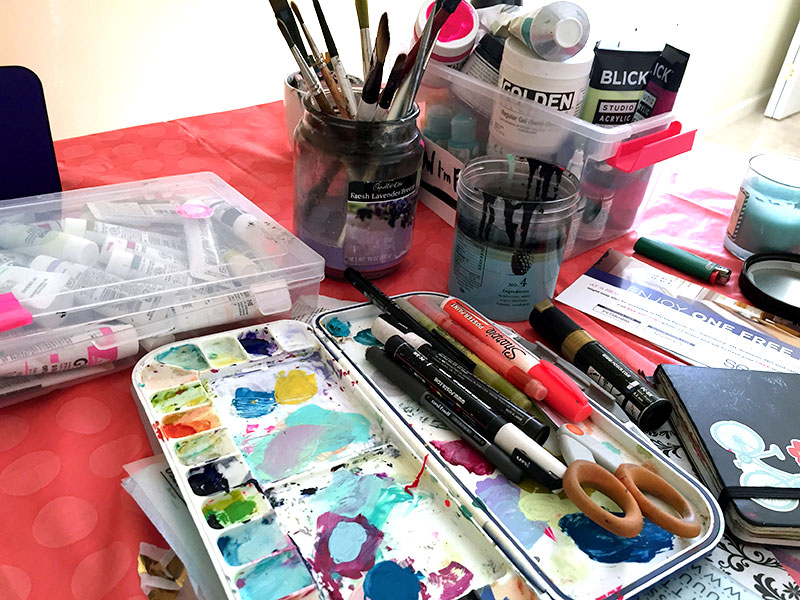
Image resolution: width=800 pixels, height=600 pixels. What are the coordinates of `plastic bin of small paint tubes` in the screenshot? It's located at (89, 279).